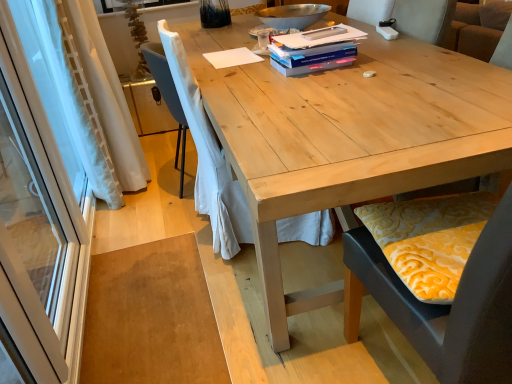
Question: From a real-world perspective, is transparent glass screen door at left on top of blue matte paperback book at upper center, the 1th paperback book from the top?

Choices:
 (A) no
 (B) yes

Answer: (A)

Question: Considering the relative sizes of transparent glass screen door at left and blue matte paperback book at upper center, acting as the third paperback book starting from the bottom, in the image provided, is transparent glass screen door at left wider than blue matte paperback book at upper center, acting as the third paperback book starting from the bottom,?

Choices:
 (A) yes
 (B) no

Answer: (B)

Question: From a real-world perspective, is transparent glass screen door at left beneath blue matte paperback book at upper center, acting as the third paperback book starting from the bottom?

Choices:
 (A) no
 (B) yes

Answer: (B)

Question: Does transparent glass screen door at left have a smaller size compared to blue matte paperback book at upper center, acting as the third paperback book starting from the bottom?

Choices:
 (A) yes
 (B) no

Answer: (B)

Question: Is transparent glass screen door at left oriented away from blue matte paperback book at upper center, acting as the third paperback book starting from the bottom?

Choices:
 (A) yes
 (B) no

Answer: (B)

Question: Is transparent glass screen door at left outside of blue matte paperback book at upper center, acting as the third paperback book starting from the bottom?

Choices:
 (A) yes
 (B) no

Answer: (A)

Question: Does yellow patterned cushion at lower right, marked as the 2th chair in a left-to-right arrangement, appear on the right side of transparent glass screen door at left?

Choices:
 (A) no
 (B) yes

Answer: (B)

Question: Would you consider yellow patterned cushion at lower right, the 2th chair in the back-to-front sequence, to be distant from transparent glass screen door at left?

Choices:
 (A) no
 (B) yes

Answer: (B)

Question: Does yellow patterned cushion at lower right, marked as the 2th chair in a left-to-right arrangement, lie behind transparent glass screen door at left?

Choices:
 (A) yes
 (B) no

Answer: (A)

Question: Can you confirm if yellow patterned cushion at lower right, which ranks as the first chair in right-to-left order, is positioned to the left of transparent glass screen door at left?

Choices:
 (A) no
 (B) yes

Answer: (A)

Question: Is transparent glass screen door at left at the back of yellow patterned cushion at lower right, the 2th chair in the back-to-front sequence?

Choices:
 (A) yes
 (B) no

Answer: (B)

Question: Does yellow patterned cushion at lower right, which ranks as the first chair in right-to-left order, have a greater height compared to transparent glass screen door at left?

Choices:
 (A) no
 (B) yes

Answer: (A)

Question: Would you consider blue matte paperback book at upper center, the 1th paperback book from the top, to be distant from white plastic remote control at upper center?

Choices:
 (A) yes
 (B) no

Answer: (B)